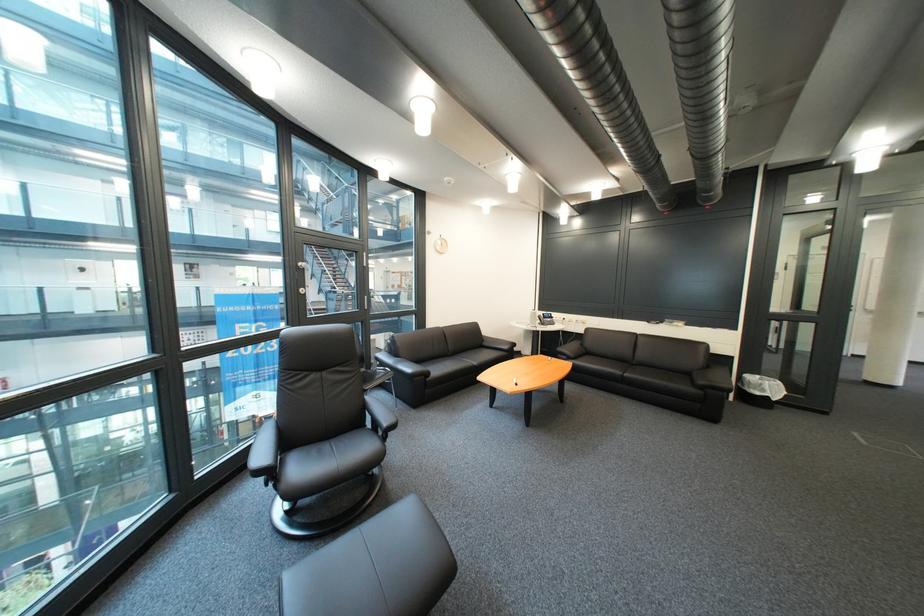
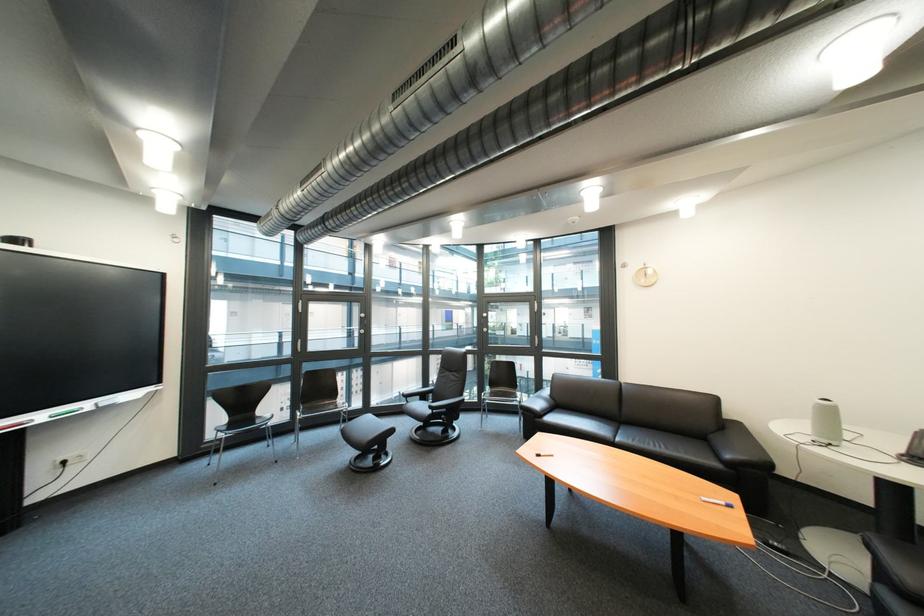
Where in the second image is the point corresponding to point (563, 361) from the first image?

(718, 501)